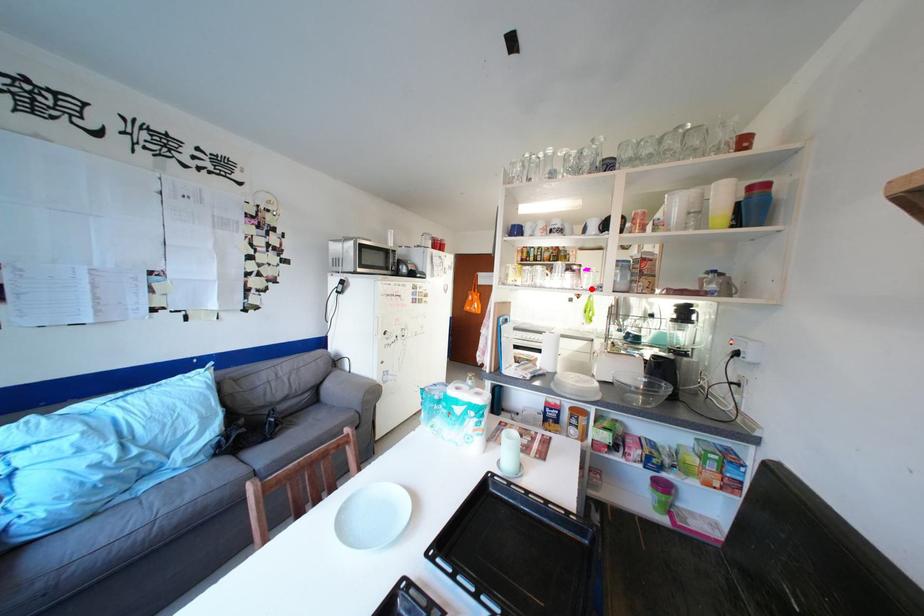
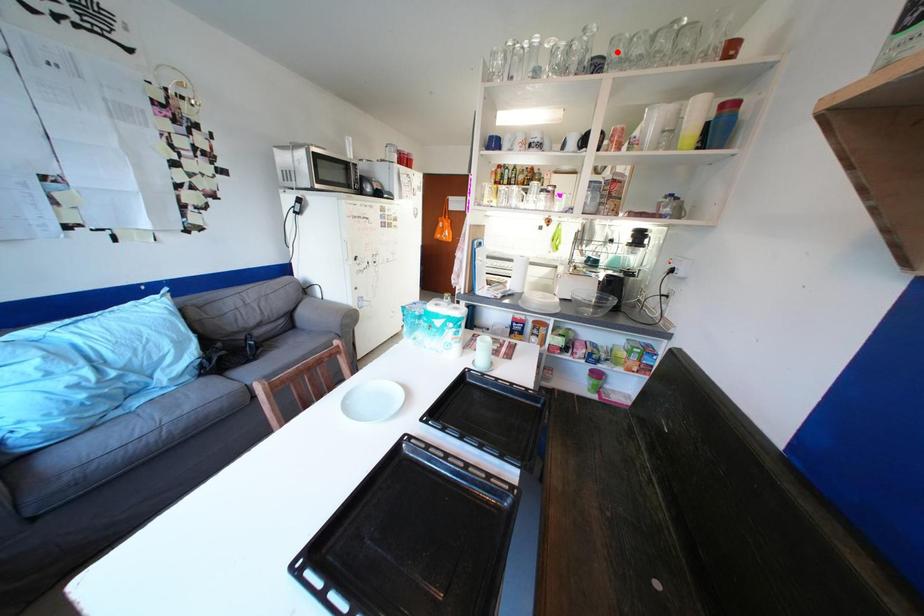
I am providing you with two images of the same scene from different viewpoints. A red point is marked on the first image and another point is marked on the second image. Do the highlighted points in image1 and image2 indicate the same real-world spot?

No